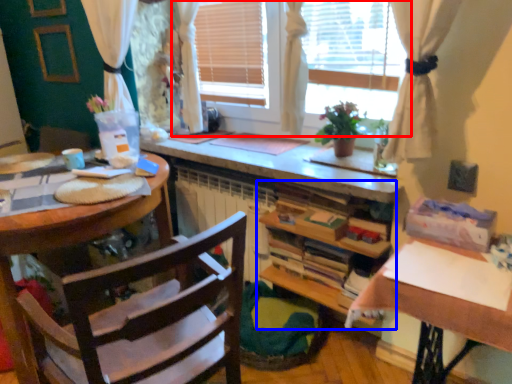
Question: Which object is further to the camera taking this photo, window (highlighted by a red box) or cabinetry (highlighted by a blue box)?

Choices:
 (A) window
 (B) cabinetry

Answer: (B)